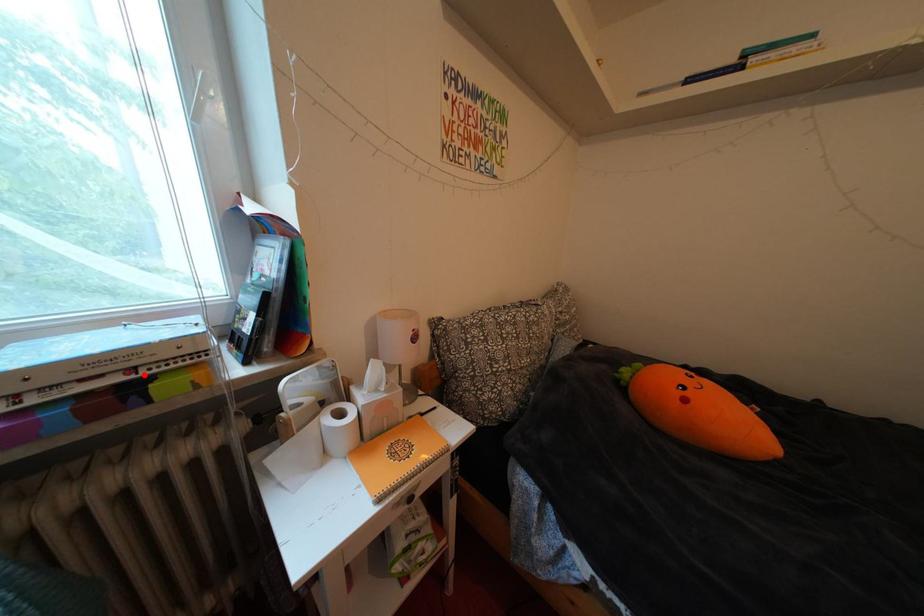
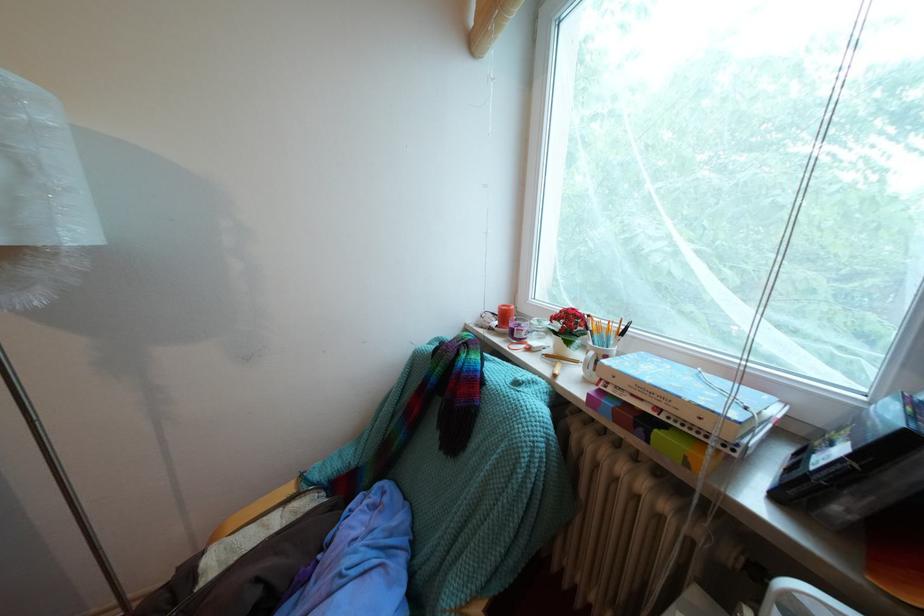
Where in the second image is the point corresponding to the highlighted location from the first image?

(669, 415)